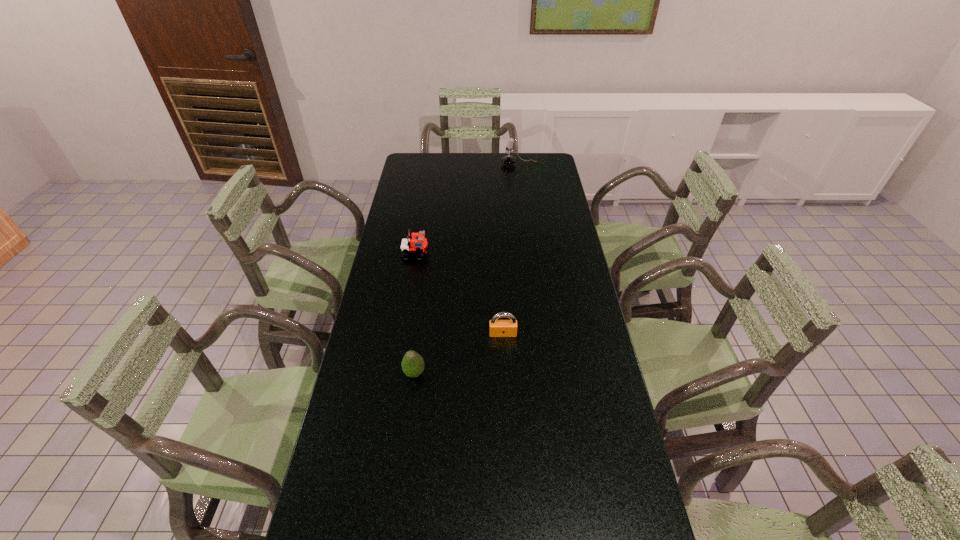
The width and height of the screenshot is (960, 540). I want to click on vacant area that lies between the nearest object and the farthest object, so click(467, 269).

This screenshot has height=540, width=960. Identify the location of free space between the farthest object and the avocado. (467, 269).

Where is `free space between the microphone and the avocado`? Image resolution: width=960 pixels, height=540 pixels. free space between the microphone and the avocado is located at coordinates (467, 269).

Locate an element on the screen. The width and height of the screenshot is (960, 540). unoccupied position between the Lego and the second nearest object is located at coordinates (459, 294).

Identify the location of free space that is in between the padlock and the avocado. (459, 354).

What are the coordinates of `free space between the microphone and the nearest object` in the screenshot? It's located at (467, 269).

At what (x,y) coordinates should I click in order to perform the action: click on object that is the third closest one to the farthest object. Please return your answer as a coordinate pair (x, y). Looking at the image, I should click on (412, 364).

Image resolution: width=960 pixels, height=540 pixels. I want to click on object that stands as the second closest to the nearest object, so click(x=418, y=245).

I want to click on vacant region that satisfies the following two spatial constraints: 1. on the front-facing side of the second farthest object; 2. on the back side of the avocado, so click(x=396, y=373).

Where is `vacant space that satisfies the following two spatial constraints: 1. on the front side of the farthest object; 2. on the front-facing side of the Lego`? vacant space that satisfies the following two spatial constraints: 1. on the front side of the farthest object; 2. on the front-facing side of the Lego is located at coordinates (531, 254).